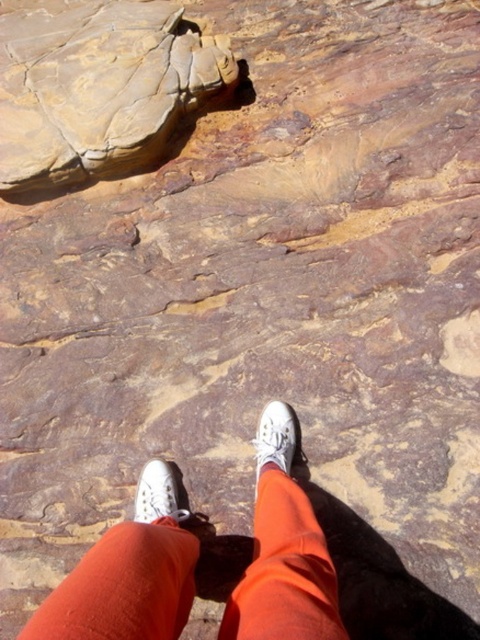
Where is `white canvas shoes at center`? The width and height of the screenshot is (480, 640). white canvas shoes at center is located at coordinates (283, 550).

Based on the photo, which of these two, white canvas shoes at center or white canvas shoe at lower center, stands shorter?

Standing shorter between the two is white canvas shoe at lower center.

Where is `white canvas shoes at center`? The width and height of the screenshot is (480, 640). white canvas shoes at center is located at coordinates (283, 550).

Is matte brown rock at upper left shorter than white canvas shoe at center?

No.

Is matte brown rock at upper left positioned before white canvas shoe at center?

That is False.

Is point (80, 163) closer to camera compared to point (285, 429)?

No, (80, 163) is further to viewer.

This screenshot has height=640, width=480. In order to click on matte brown rock at upper left in this screenshot , I will do `click(98, 88)`.

Who is shorter, white canvas shoes at center or white canvas shoe at center?

white canvas shoe at center

Can you confirm if white canvas shoes at center is positioned above white canvas shoe at center?

No, white canvas shoes at center is not above white canvas shoe at center.

Identify the location of white canvas shoes at center. The image size is (480, 640). (283, 550).